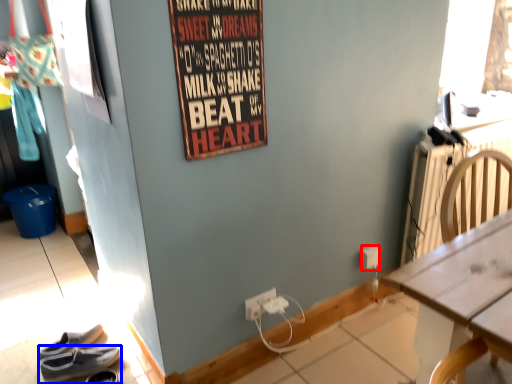
Question: Which of the following is the farthest to the observer, power outlet (highlighted by a red box) or footwear (highlighted by a blue box)?

Choices:
 (A) power outlet
 (B) footwear

Answer: (A)